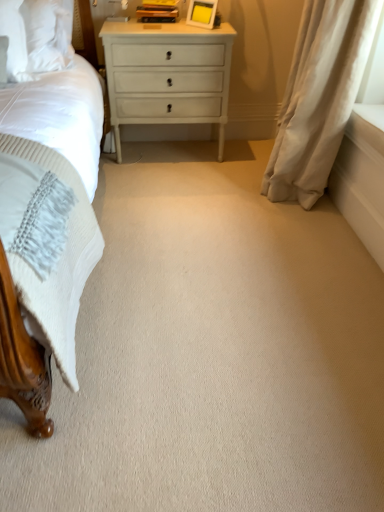
You are a GUI agent. You are given a task and a screenshot of the screen. Output one action in this format:
    pyautogui.click(x=<x>, y=<y>)
    Task: Click on the white soft curtain at right
    This screenshot has width=384, height=512.
    Given the screenshot: What is the action you would take?
    pyautogui.click(x=319, y=96)

The width and height of the screenshot is (384, 512). What do you see at coordinates (319, 96) in the screenshot?
I see `white soft curtain at right` at bounding box center [319, 96].

What are the coordinates of `white glossy nightstand at center` in the screenshot? It's located at (167, 75).

The width and height of the screenshot is (384, 512). Describe the element at coordinates (167, 75) in the screenshot. I see `white glossy nightstand at center` at that location.

At what (x,y) coordinates should I click in order to perform the action: click on white soft curtain at right. Please return your answer as a coordinate pair (x, y). The image size is (384, 512). Looking at the image, I should click on (319, 96).

Is white soft curtain at right at the right side of white glossy nightstand at center?

Correct, you'll find white soft curtain at right to the right of white glossy nightstand at center.

Does white soft curtain at right come behind white glossy nightstand at center?

No, white soft curtain at right is closer to the camera.

Which is behind, point (286, 98) or point (187, 49)?

The point (187, 49) is more distant.

From the image's perspective, is white soft curtain at right beneath white glossy nightstand at center?

Yes, from the image's perspective, white soft curtain at right is below white glossy nightstand at center.

From a real-world perspective, relative to white glossy nightstand at center, is white soft curtain at right vertically above or below?

white soft curtain at right is situated higher than white glossy nightstand at center in the real world.

Is white soft curtain at right thinner than white glossy nightstand at center?

Yes, white soft curtain at right is thinner than white glossy nightstand at center.

Does white soft curtain at right have a greater height compared to white glossy nightstand at center?

Correct, white soft curtain at right is much taller as white glossy nightstand at center.

Between white soft curtain at right and white glossy nightstand at center, which one has smaller size?

white glossy nightstand at center is smaller.

Is white soft curtain at right not inside white glossy nightstand at center?

Yes, white soft curtain at right is located beyond the bounds of white glossy nightstand at center.

Is white soft curtain at right beside white glossy nightstand at center?

There is a gap between white soft curtain at right and white glossy nightstand at center.

Is white glossy nightstand at center at the back of white soft curtain at right?

No.

In order to click on curtain that is on the right side of white glossy nightstand at center in this screenshot , I will do `click(319, 96)`.

Considering the positions of objects white glossy nightstand at center and white soft curtain at right in the image provided, who is more to the right, white glossy nightstand at center or white soft curtain at right?

white soft curtain at right.

Which object is closer to the camera taking this photo, white glossy nightstand at center or white soft curtain at right?

white soft curtain at right is in front.

Is point (153, 106) more distant than point (291, 138)?

Yes, it is.

From the image's perspective, is white glossy nightstand at center located above white soft curtain at right?

Yes, from the image's perspective, white glossy nightstand at center is above white soft curtain at right.

From a real-world perspective, is white glossy nightstand at center located higher than white soft curtain at right?

No, from a real-world perspective, white glossy nightstand at center is not over white soft curtain at right

Considering the relative sizes of white glossy nightstand at center and white soft curtain at right in the image provided, is white glossy nightstand at center thinner than white soft curtain at right?

No, white glossy nightstand at center is not thinner than white soft curtain at right.

Who is shorter, white glossy nightstand at center or white soft curtain at right?

With less height is white glossy nightstand at center.

Between white glossy nightstand at center and white soft curtain at right, which one has smaller size?

white glossy nightstand at center is smaller.

Could white soft curtain at right be considered to be inside white glossy nightstand at center?

No.

Is white glossy nightstand at center not close to white soft curtain at right?

Actually, white glossy nightstand at center and white soft curtain at right are a little close together.

Could you tell me if white glossy nightstand at center is facing white soft curtain at right?

Answer: No, white glossy nightstand at center is not oriented towards white soft curtain at right.

How far apart are white glossy nightstand at center and white soft curtain at right?

white glossy nightstand at center and white soft curtain at right are 68.89 centimeters apart from each other.

Where is `nightstand above the white soft curtain at right (from the image's perspective)`? nightstand above the white soft curtain at right (from the image's perspective) is located at coordinates (167, 75).

Locate an element on the screen. The image size is (384, 512). curtain located below the white glossy nightstand at center (from the image's perspective) is located at coordinates (319, 96).

There is a white glossy nightstand at center. Where is `curtain above it (from a real-world perspective)`? curtain above it (from a real-world perspective) is located at coordinates (319, 96).